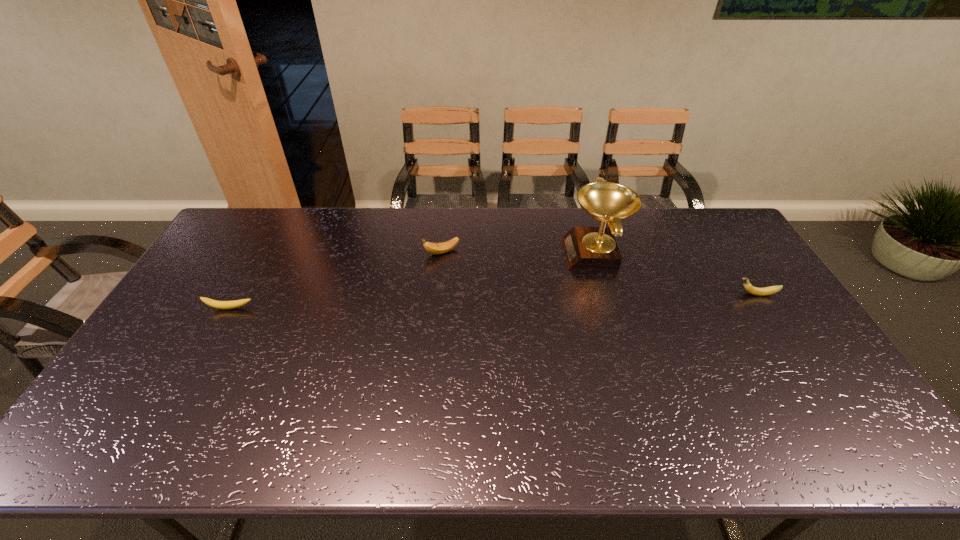
Locate an element on the screen. the third object from left to right is located at coordinates (586, 248).

Locate an element on the screen. The width and height of the screenshot is (960, 540). the tallest object is located at coordinates (586, 248).

Where is `the third object from right to left`? This screenshot has height=540, width=960. the third object from right to left is located at coordinates (434, 248).

At what (x,y) coordinates should I click in order to perform the action: click on the second banana from left to right. Please return your answer as a coordinate pair (x, y). The width and height of the screenshot is (960, 540). Looking at the image, I should click on (434, 248).

You are a GUI agent. You are given a task and a screenshot of the screen. Output one action in this format:
    pyautogui.click(x=<x>, y=<y>)
    Task: Click on the rightmost object
    The height and width of the screenshot is (540, 960).
    Given the screenshot: What is the action you would take?
    (749, 288)

You are a GUI agent. You are given a task and a screenshot of the screen. Output one action in this format:
    pyautogui.click(x=<x>, y=<y>)
    Task: Click on the rightmost banana
    The width and height of the screenshot is (960, 540).
    Given the screenshot: What is the action you would take?
    pyautogui.click(x=749, y=288)

Where is `the shortest banana`? The image size is (960, 540). the shortest banana is located at coordinates (224, 305).

This screenshot has height=540, width=960. Find the location of `the nearest banana`. the nearest banana is located at coordinates (224, 305).

Where is `vacant region located on the front-facing side of the second object from right to left`? This screenshot has width=960, height=540. vacant region located on the front-facing side of the second object from right to left is located at coordinates (548, 254).

Locate an element on the screen. The height and width of the screenshot is (540, 960). free space located on the front-facing side of the second object from right to left is located at coordinates (464, 254).